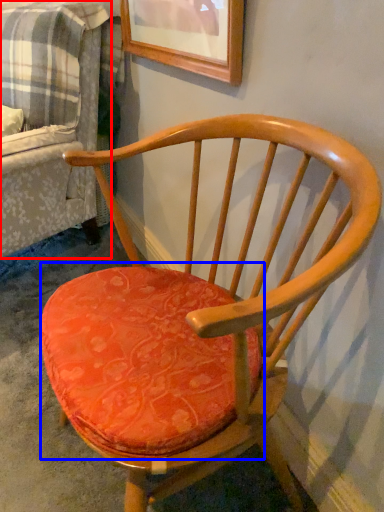
Question: Which object is closer to the camera taking this photo, couch (highlighted by a red box) or table (highlighted by a blue box)?

Choices:
 (A) couch
 (B) table

Answer: (B)